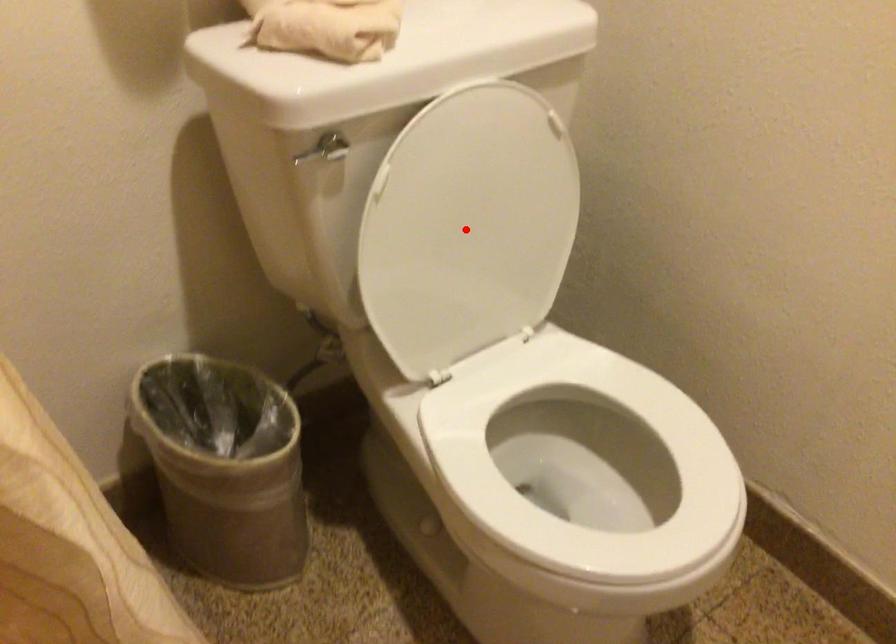
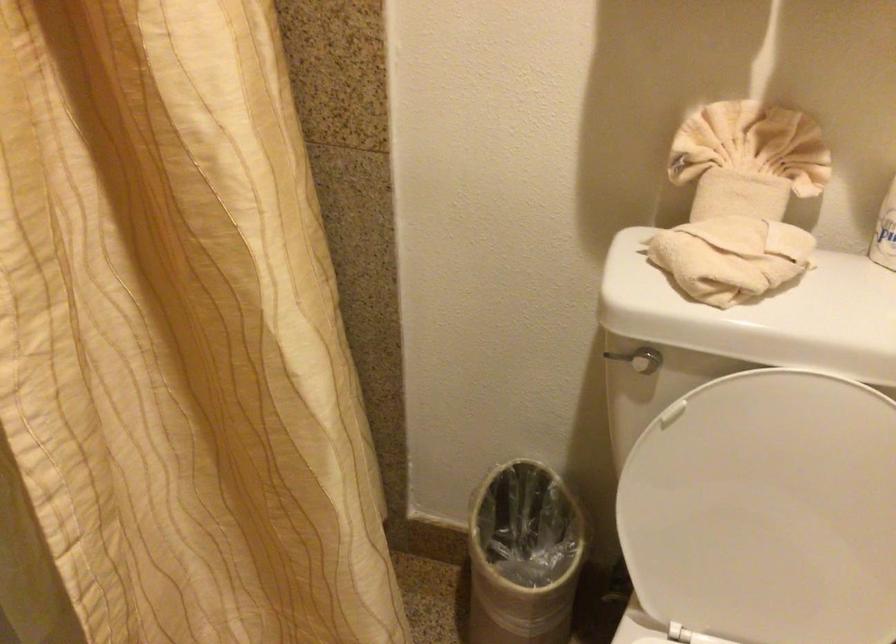
The point at the highlighted location is marked in the first image. Where is the corresponding point in the second image?

(767, 511)